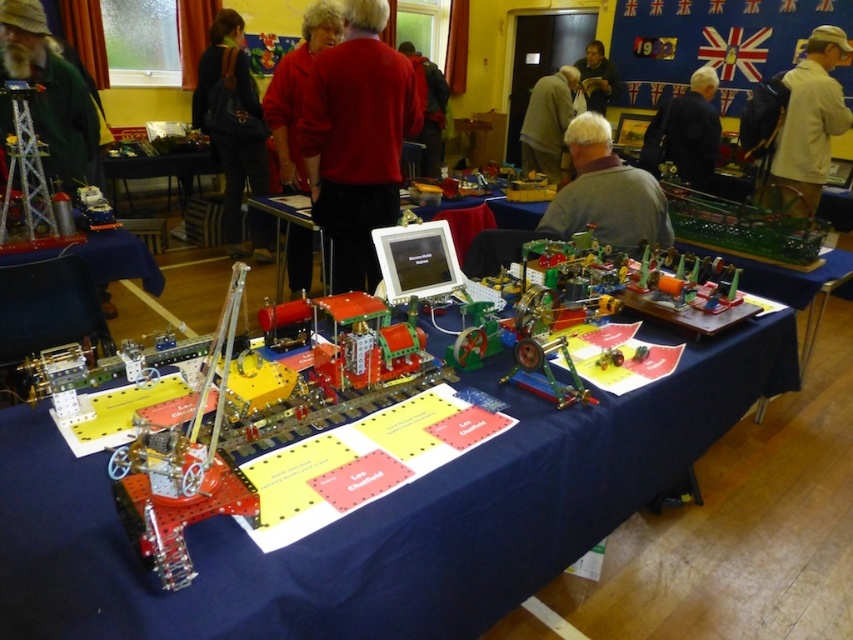
Is the position of bearded man in green jacket at left less distant than that of light brown leather jacket at upper center?

That is True.

Between point (97, 176) and point (529, 147), which one is positioned in front?

Positioned in front is point (97, 176).

Is point (88, 148) more distant than point (552, 124)?

No.

Find the location of a particular element. bearded man in green jacket at left is located at coordinates [x=50, y=92].

Does dark blue backpack at upper left have a lesser height compared to light brown leather jacket at upper center?

No.

Between dark blue backpack at upper left and light brown leather jacket at upper center, which one appears on the right side from the viewer's perspective?

light brown leather jacket at upper center

Is point (231, 22) behind point (543, 109)?

No, (231, 22) is in front of (543, 109).

Where is `dark blue backpack at upper left`? dark blue backpack at upper left is located at coordinates (231, 120).

Does red matte shirt at center have a lesser width compared to red matte jacket at center?

Correct, red matte shirt at center's width is less than red matte jacket at center's.

Is red matte shirt at center below red matte jacket at center?

Indeed, red matte shirt at center is positioned under red matte jacket at center.

Describe the element at coordinates (357, 140) in the screenshot. I see `red matte shirt at center` at that location.

Where is `red matte shirt at center`? red matte shirt at center is located at coordinates (357, 140).